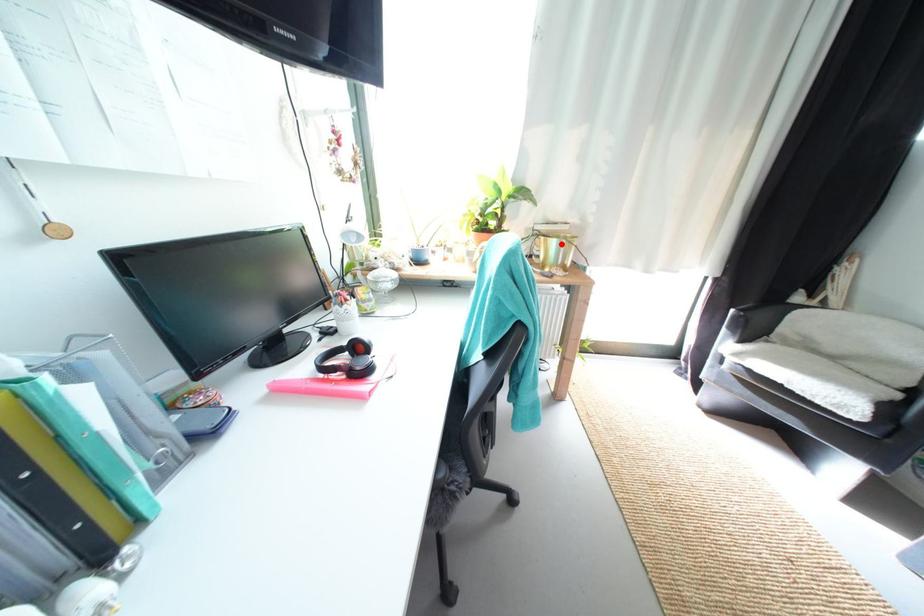
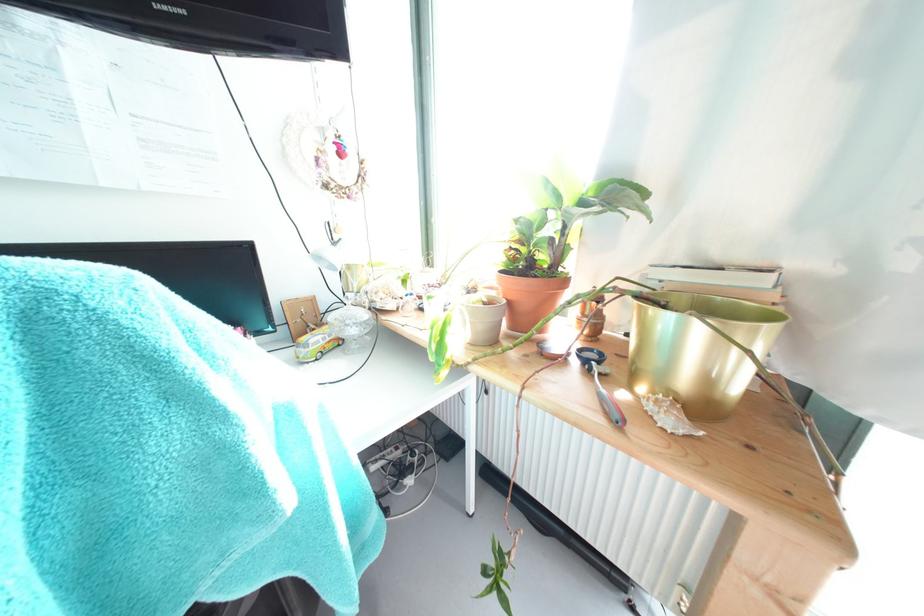
In the second image, find the point that corresponds to the highlighted location in the first image.

(675, 321)